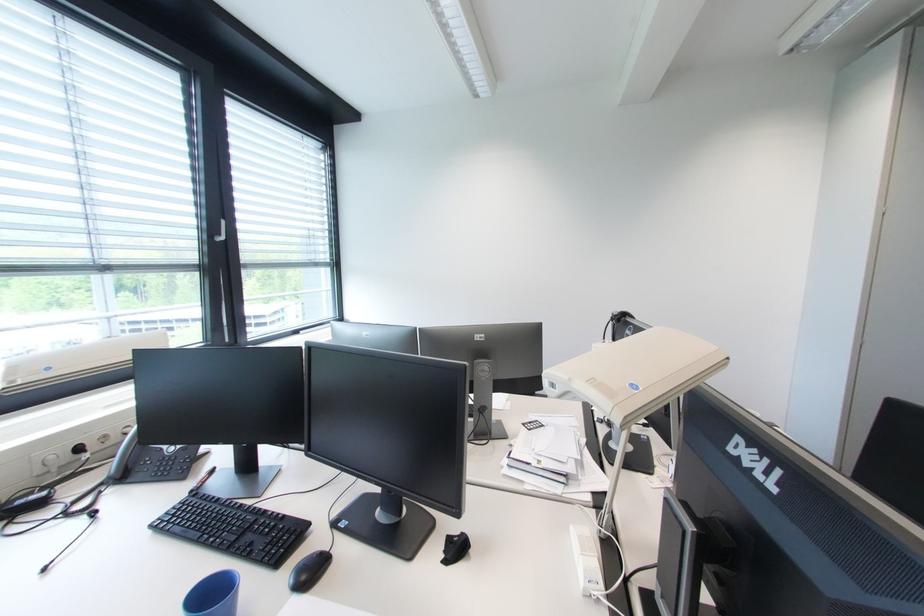
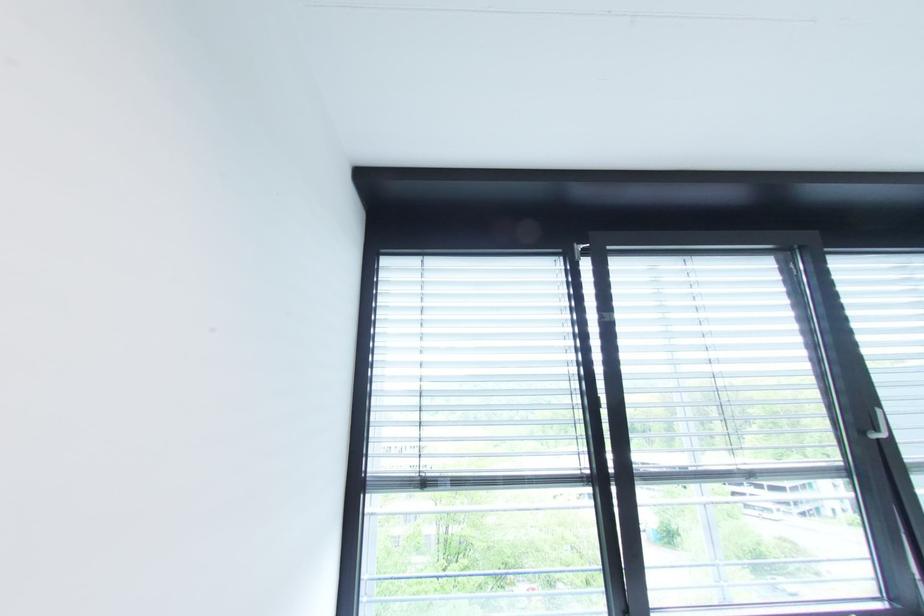
The images are taken continuously from a first-person perspective. In which direction is your viewpoint rotating?

The camera rotated toward left-up.